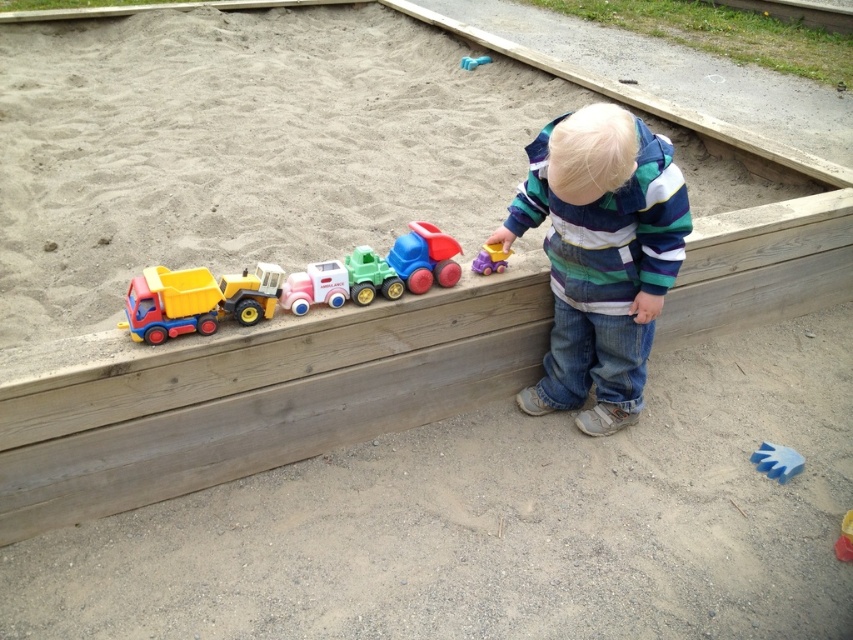
Question: Can you confirm if striped fleece jacket at upper center is positioned below pastel plastic car at center?

Choices:
 (A) no
 (B) yes

Answer: (A)

Question: Which object is the farthest from the blue rubber glove at lower right?

Choices:
 (A) matte plastic dump truck at left
 (B) purple plastic toy at center
 (C) smooth sand at upper left

Answer: (A)

Question: Which of these objects is positioned farthest from the matte yellow plastic truck at left?

Choices:
 (A) rubberized plastic truck at center
 (B) blue rubber glove at lower right

Answer: (B)

Question: Can you confirm if yellow plastic toy at upper center is positioned below blue rubber glove at lower right?

Choices:
 (A) yes
 (B) no

Answer: (A)

Question: Is pastel plastic car at center below blue rubber toy at lower right?

Choices:
 (A) no
 (B) yes

Answer: (A)

Question: Considering the real-world distances, which object is closest to the matte plastic dump truck at left?

Choices:
 (A) striped fleece jacket at upper center
 (B) blue rubber glove at lower right

Answer: (A)